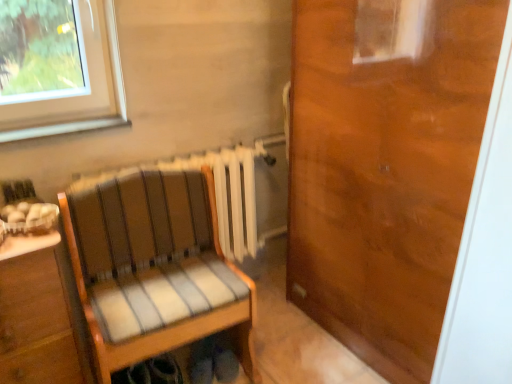
This screenshot has width=512, height=384. In order to click on vacant space positioned to the left of wooden door at right in this screenshot , I will do `click(293, 341)`.